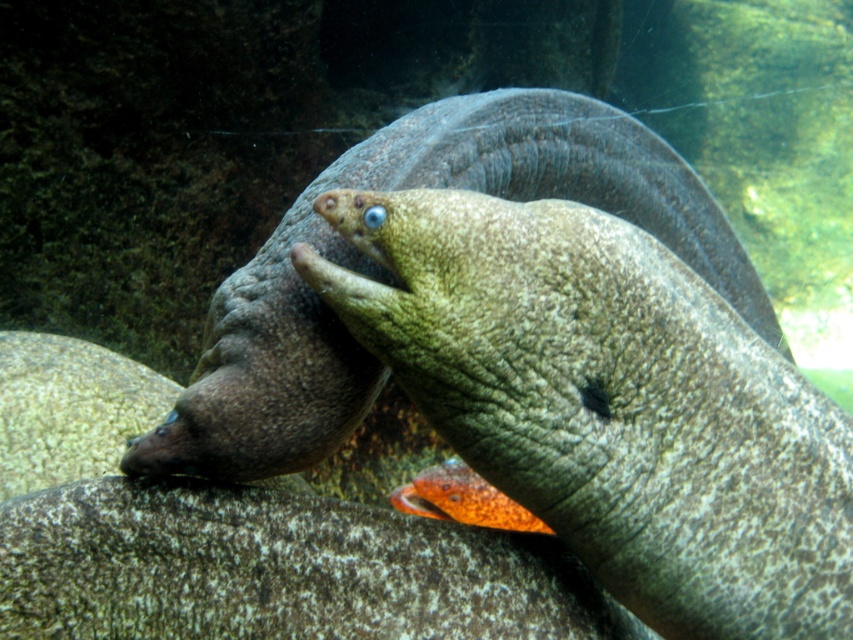
You are an aquarium maintenance worker who needs to clean the tank. The cleaning tool you have can reach up to 60 centimeters. Can you safely clean both the smooth gray moray eel at center and the orange glossy fish at center without needing to move either animal?

The distance between the smooth gray moray eel at center and the orange glossy fish at center is 68.57 centimeters. Since your tool can only reach up to 60 centimeters, you cannot safely clean both without moving them because the distance exceeds the tool reach.

You are an aquarium maintenance worker checking the tank. You notice the smooth gray moray eel at center and the orange glossy fish at center. Which one is taller?

The smooth gray moray eel at center is taller than the orange glossy fish at center.

You are an aquarium keeper and need to determine if the smooth orange fish at center can fit into a tank divider that is designed to accommodate the orange glossy fish at center. Based on their sizes, will the divider be sufficient?

The smooth orange fish at center might be wider than orange glossy fish at center, so the divider designed for the orange glossy fish at center may not be sufficient to accommodate the smooth orange fish at center due to its potentially larger width.